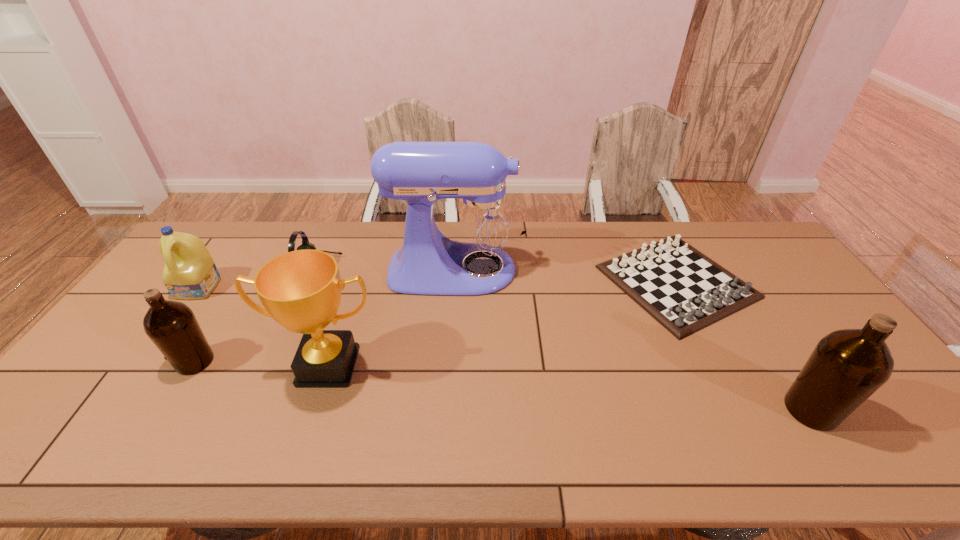
Locate an element on the screen. free spot located on the label of the shorter olive oil is located at coordinates (100, 361).

The width and height of the screenshot is (960, 540). Identify the location of free space located on the label of the shorter olive oil. (96, 361).

This screenshot has width=960, height=540. I want to click on vacant space located on the label of the nearer olive oil, so click(896, 410).

Where is `vacant area located 0.050m at the mixing area of the mixer`? Image resolution: width=960 pixels, height=540 pixels. vacant area located 0.050m at the mixing area of the mixer is located at coordinates (540, 269).

The height and width of the screenshot is (540, 960). I want to click on vacant region located 0.180m on the left of the chessboard, so click(x=543, y=282).

In order to click on free spot located 0.340m on the label of the leftmost object in this screenshot , I will do `click(122, 396)`.

Where is `free region located on the ear cushions of the headset`? free region located on the ear cushions of the headset is located at coordinates (418, 269).

In order to click on free point located 0.050m on the front-facing side of the award in this screenshot , I will do `click(313, 411)`.

Locate an element on the screen. This screenshot has width=960, height=540. mixer positioned at the far edge is located at coordinates (482, 224).

Identify the location of chessboard that is at the far edge. (685, 291).